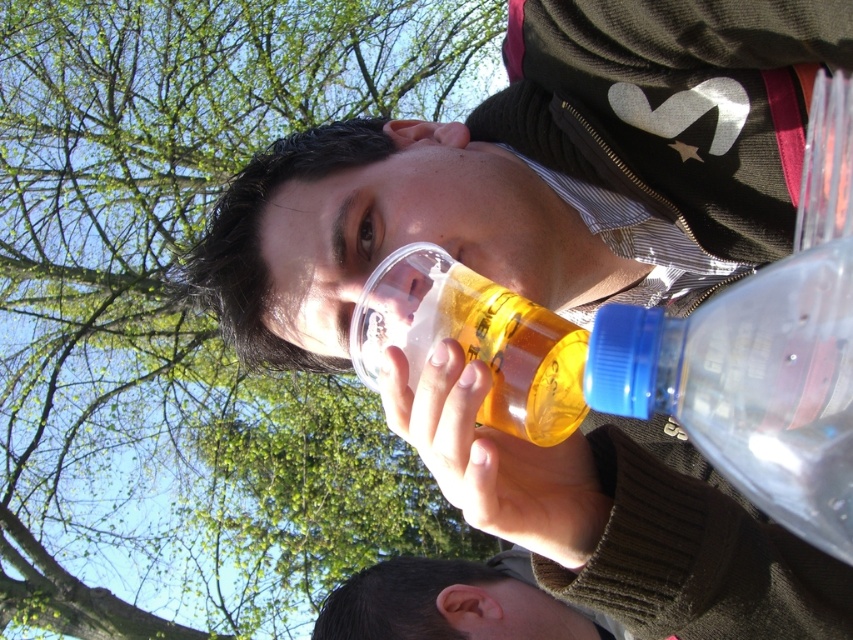
Who is higher up, transparent plastic bottle at right or translucent plastic cup at upper center?

translucent plastic cup at upper center is higher up.

Does transparent plastic bottle at right come behind translucent plastic cup at upper center?

No, it is not.

Is point (820, 406) less distant than point (387, 332)?

Yes.

Identify the location of transparent plastic bottle at right. (751, 385).